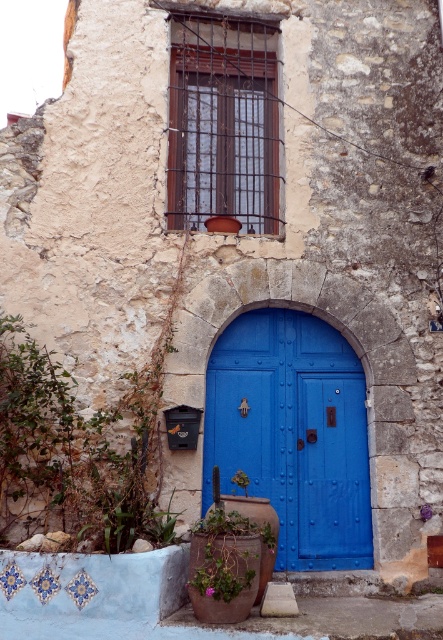
Does blue painted wood door at center lie behind green leafy plant at lower left?

Yes, it is.

Does blue painted wood door at center have a larger size compared to green leafy plant at lower left?

Actually, blue painted wood door at center might be smaller than green leafy plant at lower left.

The width and height of the screenshot is (443, 640). Identify the location of blue painted wood door at center. (292, 433).

Find the location of a particular element. The height and width of the screenshot is (640, 443). blue painted wood door at center is located at coordinates (292, 433).

Does green leafy plant at lower left have a lesser height compared to green leafy plant at center?

Incorrect, green leafy plant at lower left's height does not fall short of green leafy plant at center's.

Can you confirm if green leafy plant at lower left is bigger than green leafy plant at center?

Correct, green leafy plant at lower left is larger in size than green leafy plant at center.

You are a GUI agent. You are given a task and a screenshot of the screen. Output one action in this format:
    pyautogui.click(x=<x>, y=<y>)
    Task: Click on the green leafy plant at lower left
    This screenshot has height=640, width=443.
    Given the screenshot: What is the action you would take?
    pyautogui.click(x=73, y=451)

Can you confirm if wooden window at upper center is positioned above green leafy plant at lower center?

Yes, wooden window at upper center is above green leafy plant at lower center.

Can you confirm if wooden window at upper center is smaller than green leafy plant at lower center?

No, wooden window at upper center is not smaller than green leafy plant at lower center.

Where is `wooden window at upper center`? The width and height of the screenshot is (443, 640). wooden window at upper center is located at coordinates point(222,122).

Locate an element on the screen. wooden window at upper center is located at coordinates (222, 122).